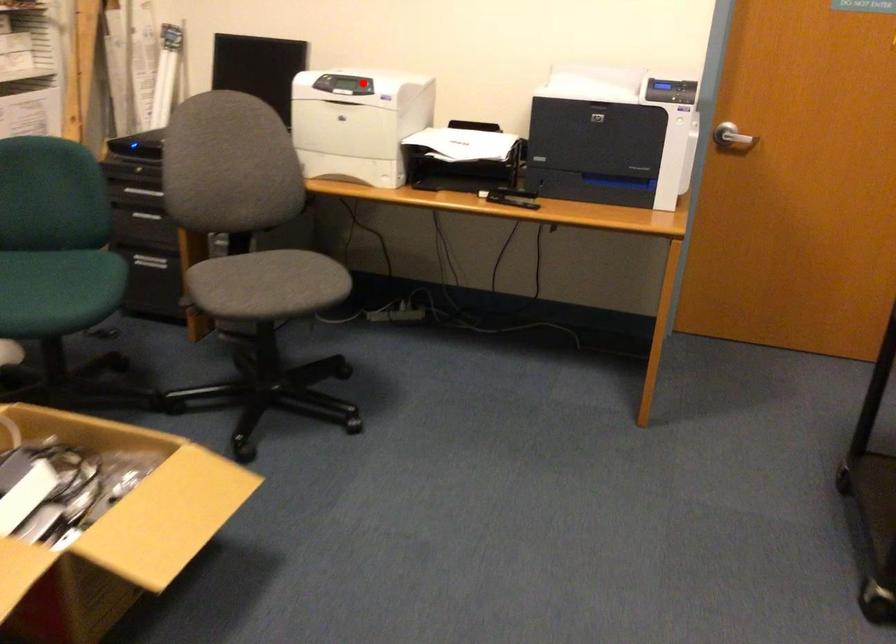
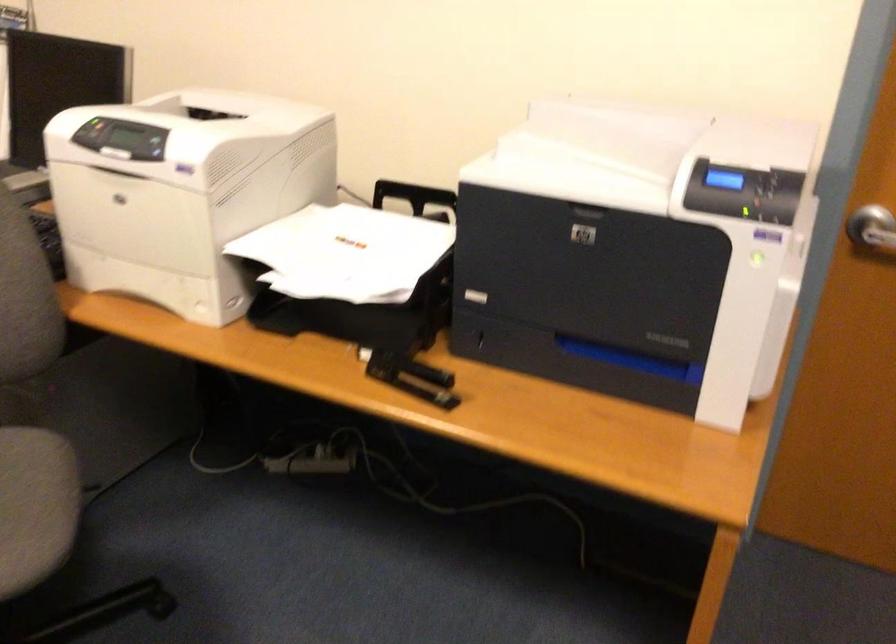
In the second image, find the point that corresponds to the highlighted location in the first image.

(151, 144)